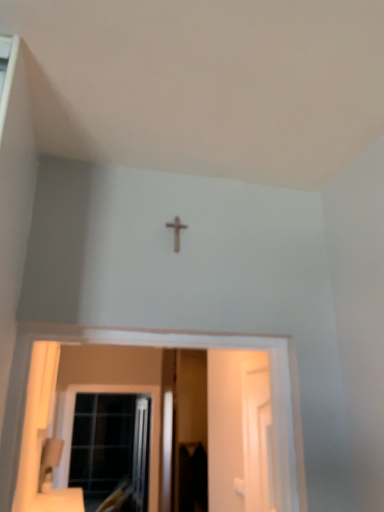
Question: Which direction should I rotate to face transparent plastic screen door at center, which ranks as the second screen door in right-to-left order, — up or down?

Choices:
 (A) up
 (B) down

Answer: (B)

Question: Considering the relative sizes of clear glass window at lower left and wooden cross at center in the image provided, is clear glass window at lower left wider than wooden cross at center?

Choices:
 (A) yes
 (B) no

Answer: (A)

Question: Considering the relative sizes of clear glass window at lower left and wooden cross at center in the image provided, is clear glass window at lower left smaller than wooden cross at center?

Choices:
 (A) no
 (B) yes

Answer: (A)

Question: Is clear glass window at lower left further to camera compared to wooden cross at center?

Choices:
 (A) no
 (B) yes

Answer: (B)

Question: Would you say clear glass window at lower left is outside wooden cross at center?

Choices:
 (A) no
 (B) yes

Answer: (B)

Question: From the image's perspective, is clear glass window at lower left beneath wooden cross at center?

Choices:
 (A) yes
 (B) no

Answer: (A)

Question: Is wooden cross at center completely or partially inside clear glass window at lower left?

Choices:
 (A) yes
 (B) no

Answer: (B)

Question: Would you consider wooden cross at center to be distant from white glossy screen door at right, the 2th screen door from the back?

Choices:
 (A) yes
 (B) no

Answer: (A)

Question: Is wooden cross at center not inside white glossy screen door at right, the second screen door positioned from the left?

Choices:
 (A) no
 (B) yes

Answer: (B)

Question: From the image's perspective, is wooden cross at center under white glossy screen door at right, the second screen door positioned from the left?

Choices:
 (A) no
 (B) yes

Answer: (A)

Question: Is wooden cross at center with white glossy screen door at right, the 2th screen door from the back?

Choices:
 (A) no
 (B) yes

Answer: (A)

Question: Can you confirm if wooden cross at center is wider than white glossy screen door at right, the 1th screen door when ordered from right to left?

Choices:
 (A) yes
 (B) no

Answer: (A)

Question: From a real-world perspective, is wooden cross at center under white glossy screen door at right, the second screen door positioned from the left?

Choices:
 (A) no
 (B) yes

Answer: (A)

Question: Does white glossy screen door at right, the second screen door positioned from the left, have a greater width compared to transparent plastic screen door at center, which ranks as the second screen door in right-to-left order?

Choices:
 (A) no
 (B) yes

Answer: (A)